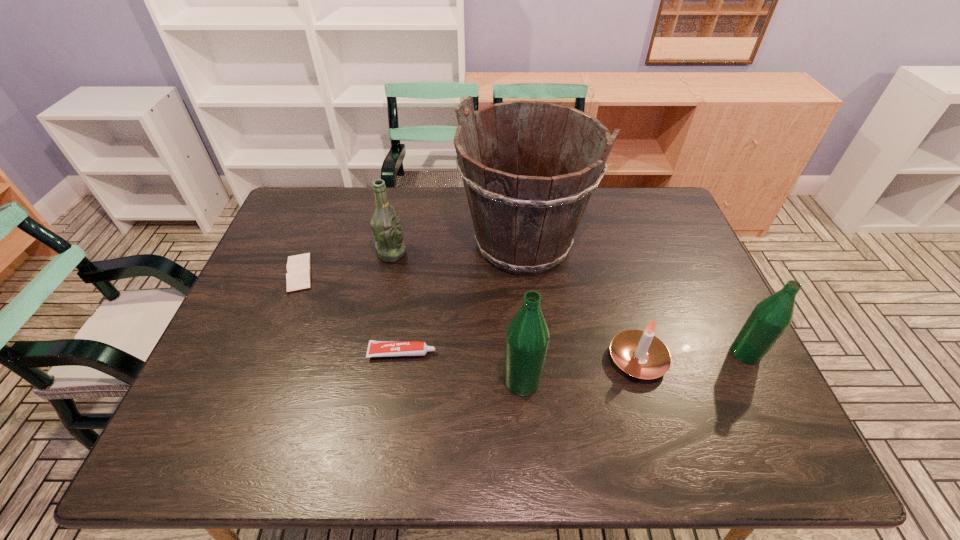
Identify the location of vacant area situated on the left of the shorter bottle. (570, 353).

The height and width of the screenshot is (540, 960). What are the coordinates of `free space located on the left of the leftmost object` in the screenshot? It's located at (258, 273).

The height and width of the screenshot is (540, 960). What are the coordinates of `vacant space located on the front of the tallest object` in the screenshot? It's located at (529, 305).

Where is `vacant area situated 0.230m on the surface of the beer bottle`? vacant area situated 0.230m on the surface of the beer bottle is located at coordinates (482, 253).

What are the coordinates of `vacant space located at the nozzle of the second shortest object` in the screenshot? It's located at (x=595, y=353).

Locate an element on the screen. vacant space located on the right of the candle is located at coordinates (740, 360).

The image size is (960, 540). I want to click on object at the far edge, so click(525, 217).

The image size is (960, 540). What are the coordinates of `bottle present at the near edge` in the screenshot? It's located at (527, 337).

Where is `candle present at the near edge`? candle present at the near edge is located at coordinates (638, 353).

Identify the location of object that is at the left edge. The image size is (960, 540). click(298, 276).